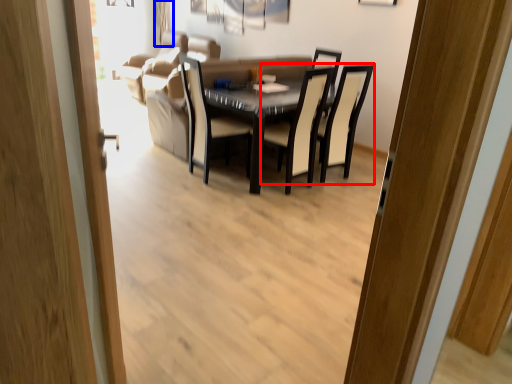
Question: Which point is further to the camera, chair (highlighted by a red box) or curtain (highlighted by a blue box)?

Choices:
 (A) chair
 (B) curtain

Answer: (B)